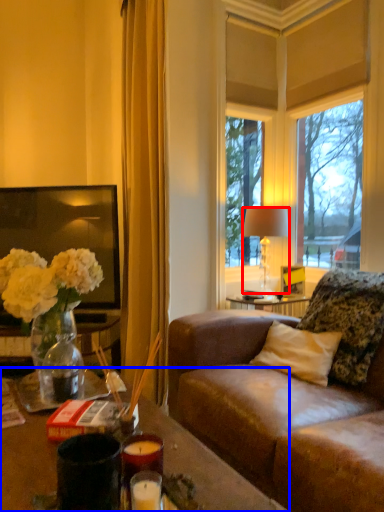
Question: Which point is further to the camera, lamp (highlighted by a red box) or desk (highlighted by a blue box)?

Choices:
 (A) lamp
 (B) desk

Answer: (A)